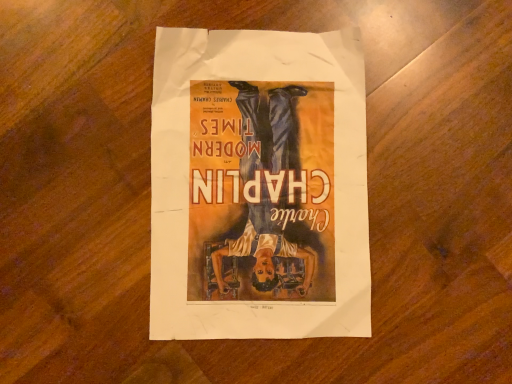
Locate an element on the screen. vacant space situated above matte paper poster at center (from a real-world perspective) is located at coordinates (257, 181).